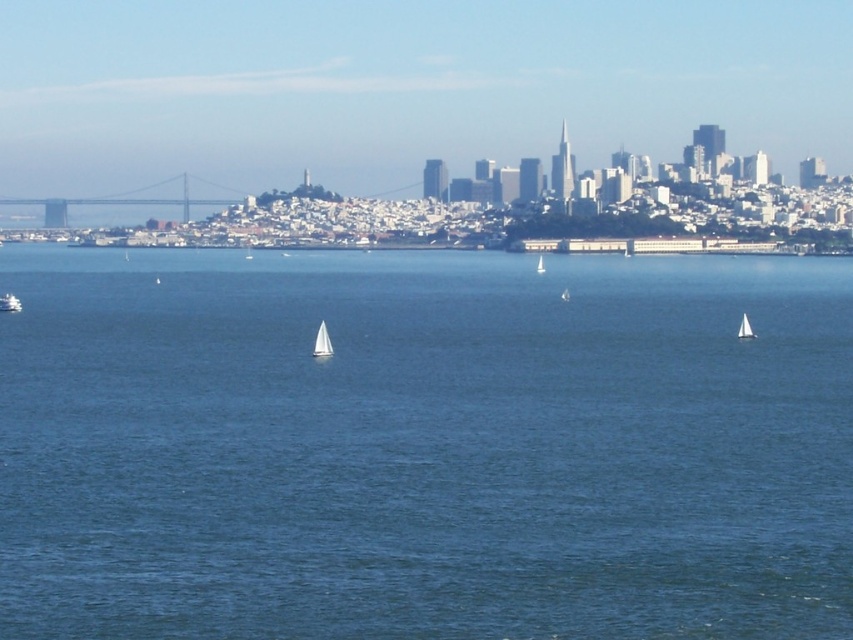
You are a tourist standing at the edge of the coast and see the blue water at center and the white matte sailboat at lower left. Which object is closer to your left side?

The white matte sailboat at lower left is closer to your left side because it is positioned on the left side of the blue water at center.

You are standing at the point marked as point (422, 445) in the image. What is the nearest object to you in the scene?

The blue water at center is located at point (422, 445), so you are standing in the blue water at center.

In the scene shown: You are a photographer planning to capture the city skyline in the background. You have two sailboats in your frame, the white matte sailboat at lower left and the white sailboat at right. Which sailboat is closer to the suspension bridge in the middle ground?

The white sailboat at right is closer to the suspension bridge in the middle ground because it is larger in size compared to the white matte sailboat at lower left, indicating it is nearer to the viewer.